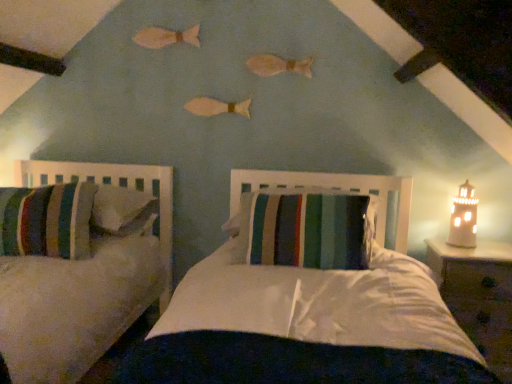
Question: Is wooden nightstand at right taller than white ceramic lighthouse at right?

Choices:
 (A) yes
 (B) no

Answer: (A)

Question: Considering the relative sizes of wooden nightstand at right and white ceramic lighthouse at right in the image provided, is wooden nightstand at right bigger than white ceramic lighthouse at right?

Choices:
 (A) yes
 (B) no

Answer: (A)

Question: Is the surface of wooden nightstand at right in direct contact with white ceramic lighthouse at right?

Choices:
 (A) no
 (B) yes

Answer: (A)

Question: From a real-world perspective, is wooden nightstand at right physically above white ceramic lighthouse at right?

Choices:
 (A) yes
 (B) no

Answer: (B)

Question: Considering the relative sizes of wooden nightstand at right and white ceramic lighthouse at right in the image provided, is wooden nightstand at right shorter than white ceramic lighthouse at right?

Choices:
 (A) yes
 (B) no

Answer: (B)

Question: In terms of height, does striped fabric pillow at center look taller or shorter compared to wooden nightstand at right?

Choices:
 (A) short
 (B) tall

Answer: (A)

Question: From a real-world perspective, relative to wooden nightstand at right, is striped fabric pillow at center vertically above or below?

Choices:
 (A) above
 (B) below

Answer: (A)

Question: Considering the positions of striped fabric pillow at center and wooden nightstand at right in the image, is striped fabric pillow at center wider or thinner than wooden nightstand at right?

Choices:
 (A) thin
 (B) wide

Answer: (B)

Question: Is striped fabric pillow at center spatially inside wooden nightstand at right, or outside of it?

Choices:
 (A) inside
 (B) outside

Answer: (B)

Question: Is white ceramic lighthouse at right situated inside striped fabric pillow at center or outside?

Choices:
 (A) outside
 (B) inside

Answer: (A)

Question: Is white ceramic lighthouse at right taller or shorter than striped fabric pillow at center?

Choices:
 (A) short
 (B) tall

Answer: (B)

Question: Is white ceramic lighthouse at right in front of or behind striped fabric pillow at center in the image?

Choices:
 (A) front
 (B) behind

Answer: (B)

Question: Considering the relative positions of white ceramic lighthouse at right and striped fabric pillow at center in the image provided, is white ceramic lighthouse at right to the left or to the right of striped fabric pillow at center?

Choices:
 (A) right
 (B) left

Answer: (A)

Question: Relative to wooden nightstand at right, is white ceramic lighthouse at right in front or behind?

Choices:
 (A) behind
 (B) front

Answer: (A)

Question: From a real-world perspective, relative to wooden nightstand at right, is white ceramic lighthouse at right vertically above or below?

Choices:
 (A) below
 (B) above

Answer: (B)